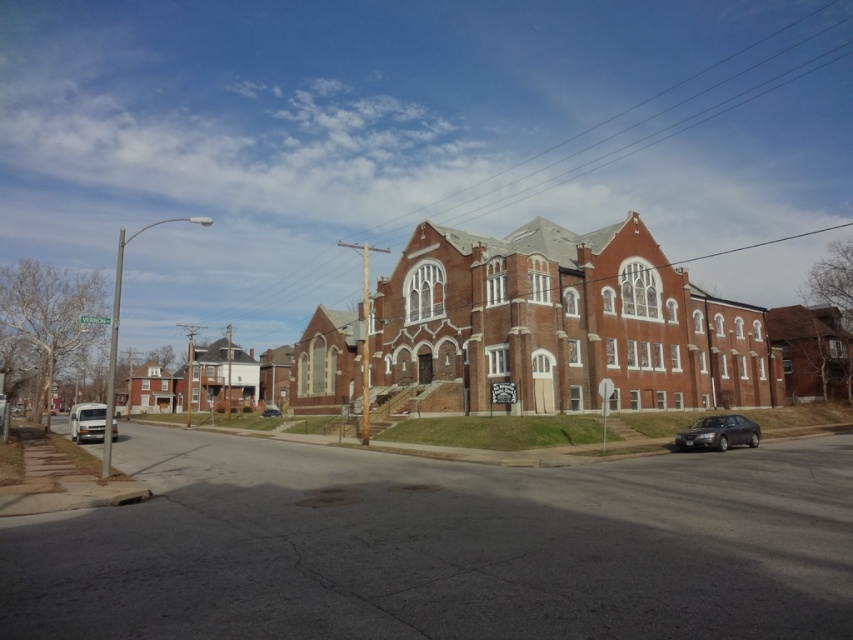
Can you confirm if brick church at center is smaller than shiny black sedan at lower right?

Incorrect, brick church at center is not smaller in size than shiny black sedan at lower right.

Who is more forward, (386, 296) or (688, 426)?

Point (688, 426)

Who is more distant from viewer, (601,358) or (679,442)?

The point (601,358) is more distant.

Image resolution: width=853 pixels, height=640 pixels. Identify the location of brick church at center. (561, 323).

Which is more to the right, brick church at center or metallic silver car at center?

brick church at center

Who is lower down, brick church at center or metallic silver car at center?

metallic silver car at center is lower down.

Who is more forward, (630, 372) or (274, 413)?

Point (630, 372) is in front.

The height and width of the screenshot is (640, 853). Find the location of `brick church at center`. brick church at center is located at coordinates (561, 323).

Is white matte van at lower left thinner than metallic silver car at center?

No.

Can you confirm if white matte van at lower left is positioned to the left of metallic silver car at center?

Indeed, white matte van at lower left is positioned on the left side of metallic silver car at center.

This screenshot has width=853, height=640. Find the location of `white matte van at lower left`. white matte van at lower left is located at coordinates (86, 420).